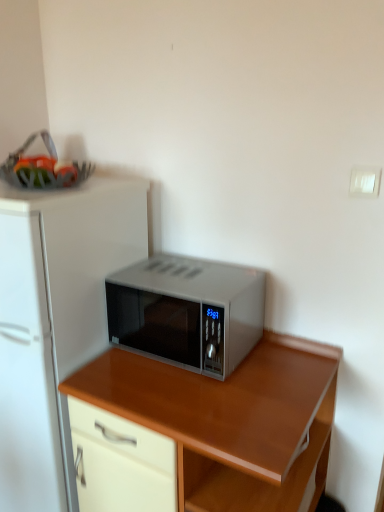
Question: Can satin silver microwave at center be found inside wooden desk at center?

Choices:
 (A) no
 (B) yes

Answer: (A)

Question: Is wooden desk at center positioned before satin silver microwave at center?

Choices:
 (A) no
 (B) yes

Answer: (B)

Question: Is wooden desk at center far away from satin silver microwave at center?

Choices:
 (A) no
 (B) yes

Answer: (A)

Question: Can you see wooden desk at center touching satin silver microwave at center?

Choices:
 (A) yes
 (B) no

Answer: (B)

Question: Can you confirm if wooden desk at center is bigger than satin silver microwave at center?

Choices:
 (A) yes
 (B) no

Answer: (A)

Question: Is wooden desk at center outside satin silver microwave at center?

Choices:
 (A) no
 (B) yes

Answer: (B)

Question: Does wooden desk at center have a greater width compared to white matte refrigerator at center?

Choices:
 (A) yes
 (B) no

Answer: (B)

Question: From a real-world perspective, is wooden desk at center on top of white matte refrigerator at center?

Choices:
 (A) yes
 (B) no

Answer: (B)

Question: Does wooden desk at center come behind white matte refrigerator at center?

Choices:
 (A) no
 (B) yes

Answer: (A)

Question: Is wooden desk at center to the left of white matte refrigerator at center from the viewer's perspective?

Choices:
 (A) no
 (B) yes

Answer: (A)

Question: Can you confirm if wooden desk at center is smaller than white matte refrigerator at center?

Choices:
 (A) no
 (B) yes

Answer: (B)

Question: Is wooden desk at center shorter than white matte refrigerator at center?

Choices:
 (A) no
 (B) yes

Answer: (B)

Question: Does white matte refrigerator at center appear on the left side of wooden desk at center?

Choices:
 (A) no
 (B) yes

Answer: (B)